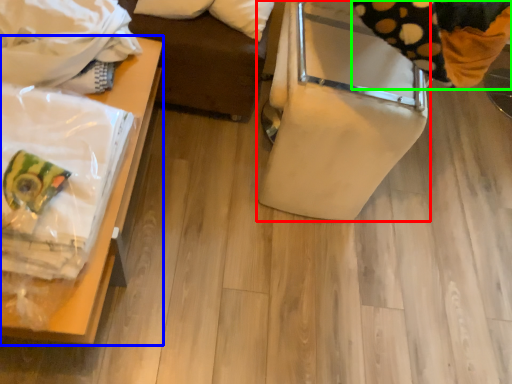
Question: Based on their relative distances, which object is nearer to furniture (highlighted by a red box)? Choose from furniture (highlighted by a blue box) and material (highlighted by a green box).

Choices:
 (A) furniture
 (B) material

Answer: (B)